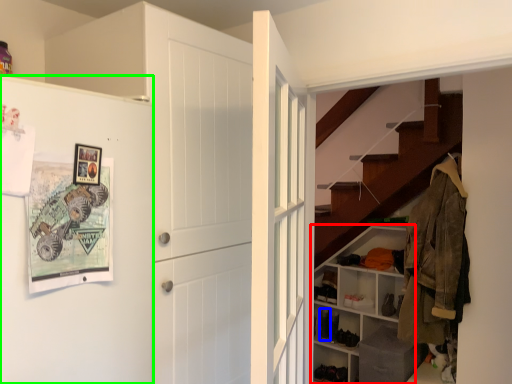
Question: Which is nearer to the shelf (highlighted by a red box)? shoe (highlighted by a blue box) or fridge (highlighted by a green box).

Choices:
 (A) shoe
 (B) fridge

Answer: (A)